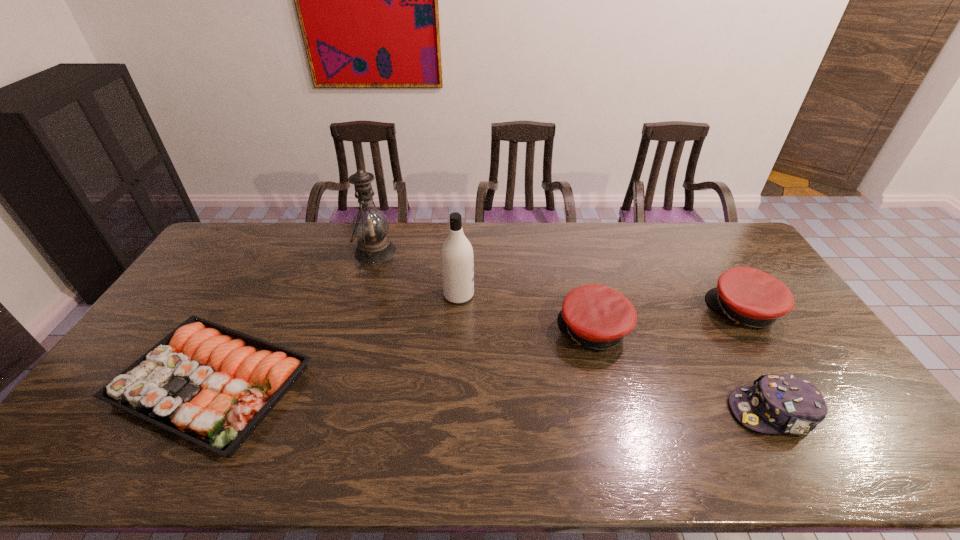
I want to click on vacant space at the far edge of the desktop, so click(x=301, y=226).

The width and height of the screenshot is (960, 540). In the image, there is a desktop. In order to click on free space at the left edge in this screenshot , I will do `click(211, 299)`.

Find the location of a particular element. The width and height of the screenshot is (960, 540). vacant space at the right edge is located at coordinates (808, 341).

You are a GUI agent. You are given a task and a screenshot of the screen. Output one action in this format:
    pyautogui.click(x=<x>, y=<y>)
    Task: Click on the vacant space at the near left corner of the desktop
    This screenshot has height=540, width=960.
    Given the screenshot: What is the action you would take?
    pyautogui.click(x=106, y=440)

You are a GUI agent. You are given a task and a screenshot of the screen. Output one action in this format:
    pyautogui.click(x=<x>, y=<y>)
    Task: Click on the vacant space at the far right corner of the desktop
    The width and height of the screenshot is (960, 540).
    Given the screenshot: What is the action you would take?
    pyautogui.click(x=725, y=232)

You are a GUI agent. You are given a task and a screenshot of the screen. Output one action in this format:
    pyautogui.click(x=<x>, y=<y>)
    Task: Click on the empty space between the oil lamp and the shortest object
    The width and height of the screenshot is (960, 540).
    Given the screenshot: What is the action you would take?
    pyautogui.click(x=294, y=318)

Where is `vacant area between the third object from right to left and the farthest object`? vacant area between the third object from right to left and the farthest object is located at coordinates point(485,291).

Where is `vacant region between the fourth object from right to left and the oil lamp`? This screenshot has height=540, width=960. vacant region between the fourth object from right to left and the oil lamp is located at coordinates (x=417, y=273).

Where is `free area in between the fourth object from right to left and the farthest object`? free area in between the fourth object from right to left and the farthest object is located at coordinates (417, 273).

Find the location of a particular element. The width and height of the screenshot is (960, 540). vacant space in between the platter and the shampoo is located at coordinates tap(335, 340).